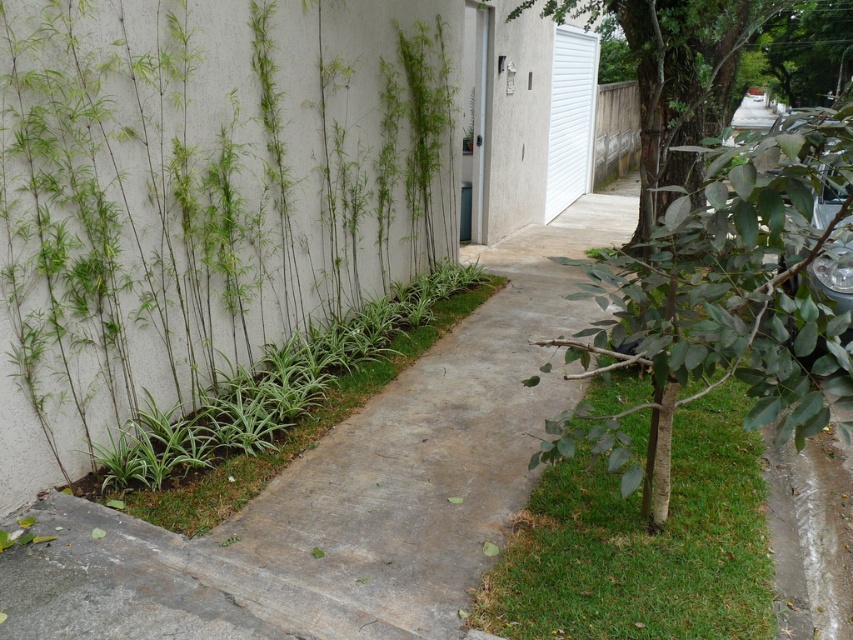
Question: Does green bamboo at left have a smaller size compared to green leafy tree at right?

Choices:
 (A) no
 (B) yes

Answer: (A)

Question: Can you confirm if green bamboo at left is thinner than green grass at center?

Choices:
 (A) no
 (B) yes

Answer: (B)

Question: Can you confirm if green bamboo at left is positioned below green leafy tree at right?

Choices:
 (A) yes
 (B) no

Answer: (B)

Question: Which of the following is the closest to the observer?

Choices:
 (A) green bamboo at left
 (B) green grass at center

Answer: (B)

Question: Estimate the real-world distances between objects in this image. Which object is farther from the green grass at center?

Choices:
 (A) green bamboo at left
 (B) green leafy tree at right

Answer: (A)

Question: Which of the following is the closest to the observer?

Choices:
 (A) (689, 474)
 (B) (236, 292)
 (C) (817, 124)

Answer: (C)